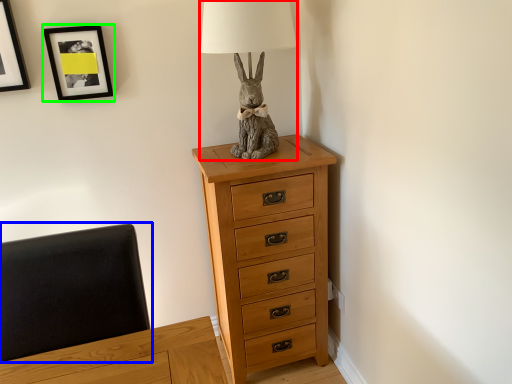
Question: Considering the real-world distances, which object is closest to table lamp (highlighted by a red box)? swivel chair (highlighted by a blue box) or picture frame (highlighted by a green box).

Choices:
 (A) swivel chair
 (B) picture frame

Answer: (B)